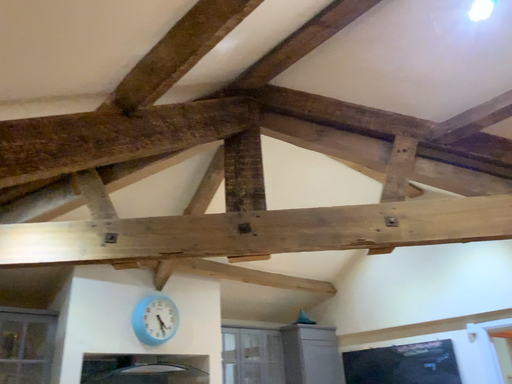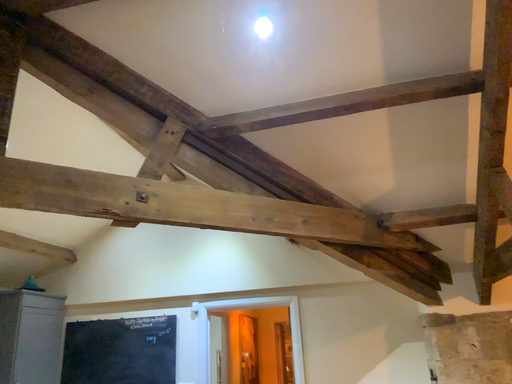
Question: How did the camera likely rotate when shooting the video?

Choices:
 (A) rotated left
 (B) rotated right

Answer: (B)